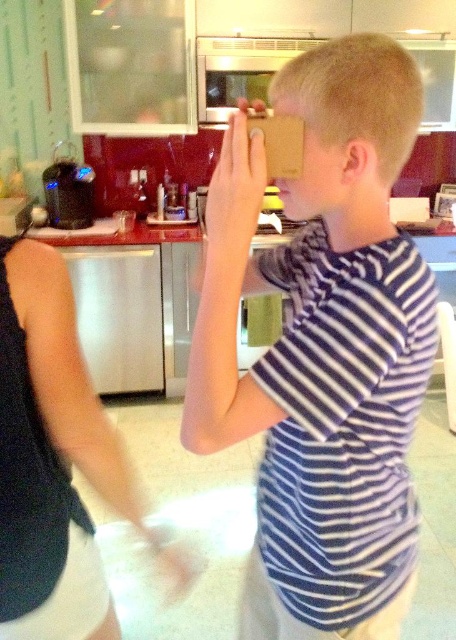
You are a photographer trying to capture both the white striped shirt at center and the white fabric shirt at left in a single shot. However, due to the camera lens limitations, you can only focus on one shirt at a time. Which shirt should you focus on to ensure the other remains in the background?

You should focus on the white striped shirt at center because it is in front of the white fabric shirt at left, so if you focus on the front shirt, the background shirt will still be visible but slightly out of focus.

You are a fashion designer observing two shirts in a kitchen scene. The shirts are the white striped shirt at center and the white fabric shirt at left. Which shirt would you recommend for a client who prefers a more voluminous style?

The white striped shirt at center is bigger than the white fabric shirt at left, so it would be the better recommendation for a client preferring a more voluminous style.

You are a photographer setting up a photoshoot in the kitchen. You need to place two shirts on the counter for a product shot. The white striped shirt at center and the white fabric shirt at left must be arranged so that the taller one is behind the shorter one. Which shirt should be placed behind the other?

The white striped shirt at center is much taller than the white fabric shirt at left, so the white striped shirt at center should be placed behind the white fabric shirt at left to ensure the taller one is behind the shorter one.